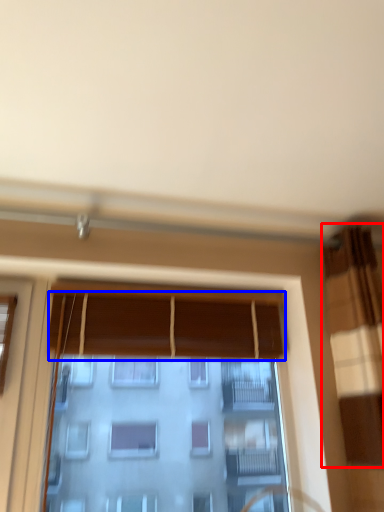
Question: Among these objects, which one is farthest to the camera, curtain (highlighted by a red box) or curtain (highlighted by a blue box)?

Choices:
 (A) curtain
 (B) curtain

Answer: (B)